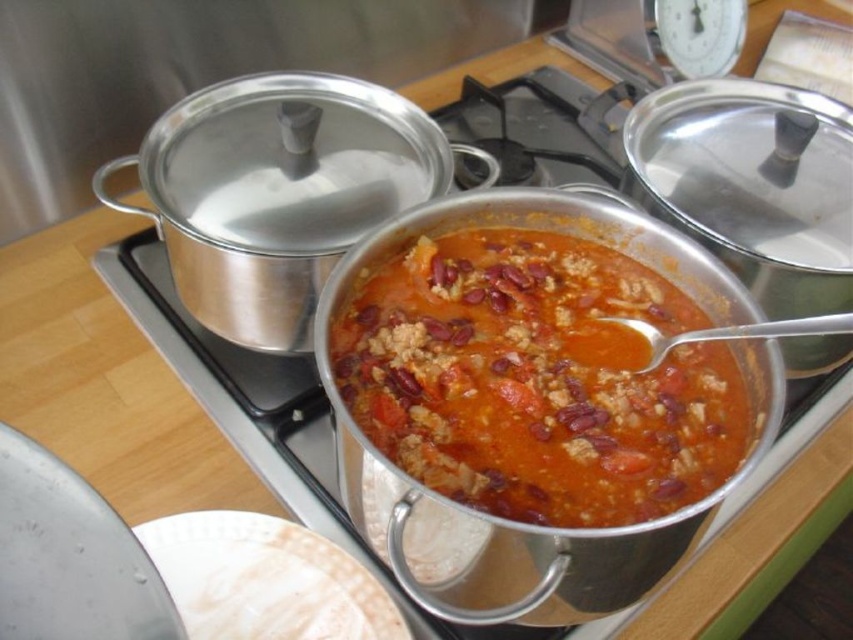
Question: Which point appears farthest from the camera in this image?

Choices:
 (A) (384, 616)
 (B) (769, 332)

Answer: (A)

Question: Can you confirm if tomato-based stew at center is positioned to the left of silver metallic spoon at center?

Choices:
 (A) no
 (B) yes

Answer: (B)

Question: Which is nearer to the white matte plate at lower left?

Choices:
 (A) silver metallic spoon at center
 (B) tomato-based stew at center

Answer: (B)

Question: Where is tomato-based stew at center located in relation to silver metallic spoon at center in the image?

Choices:
 (A) below
 (B) above

Answer: (A)

Question: Among these objects, which one is nearest to the camera?

Choices:
 (A) white matte plate at lower left
 (B) tomato-based stew at center
 (C) silver metallic spoon at center

Answer: (B)

Question: Where is tomato-based stew at center located in relation to silver metallic spoon at center in the image?

Choices:
 (A) below
 (B) above

Answer: (A)